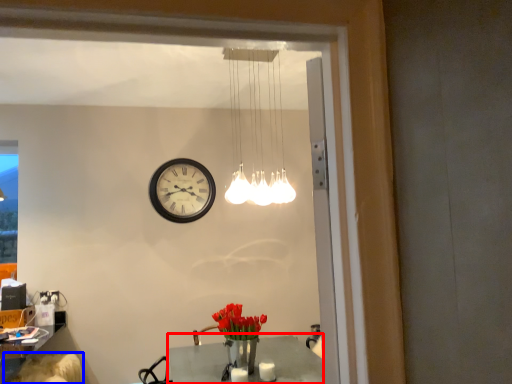
Question: Among these objects, which one is nearest to the camera, table (highlighted by a red box) or swivel chair (highlighted by a blue box)?

Choices:
 (A) table
 (B) swivel chair

Answer: (A)